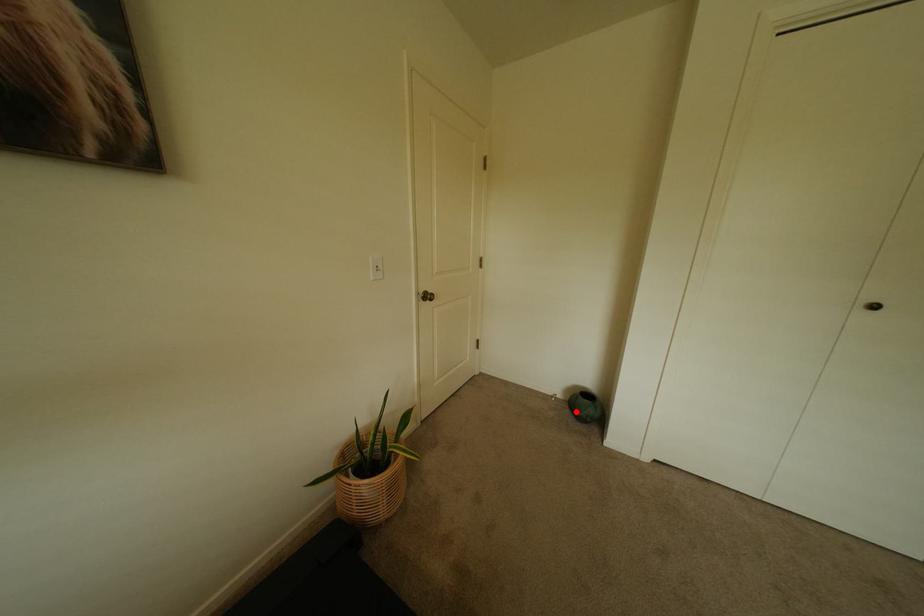
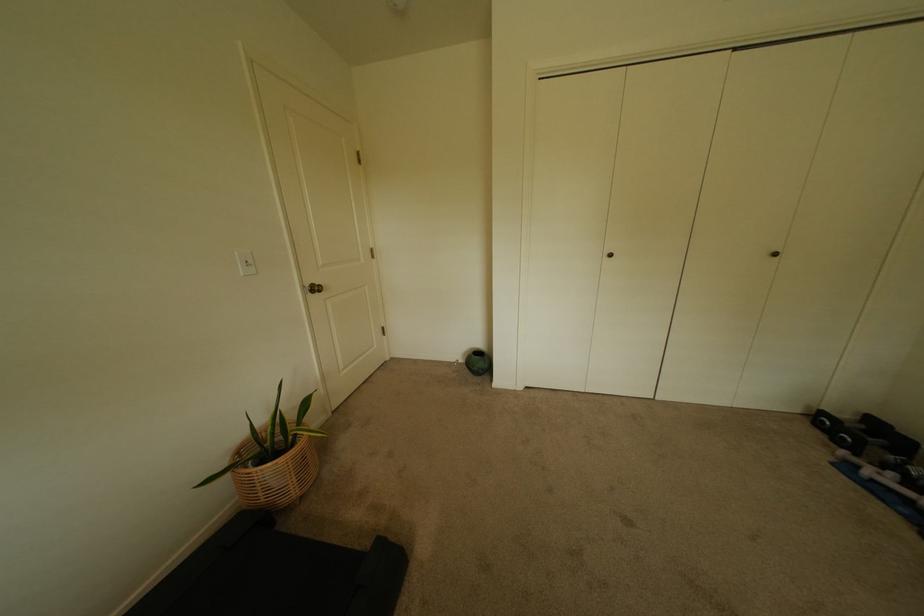
In the second image, find the point that corresponds to the highlighted location in the first image.

(476, 371)